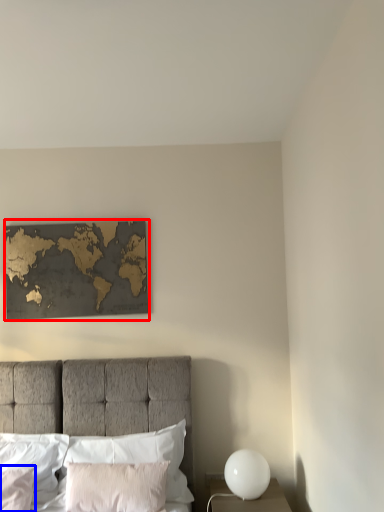
Question: Which object appears farthest to the camera in this image, picture frame (highlighted by a red box) or pillow (highlighted by a blue box)?

Choices:
 (A) picture frame
 (B) pillow

Answer: (A)